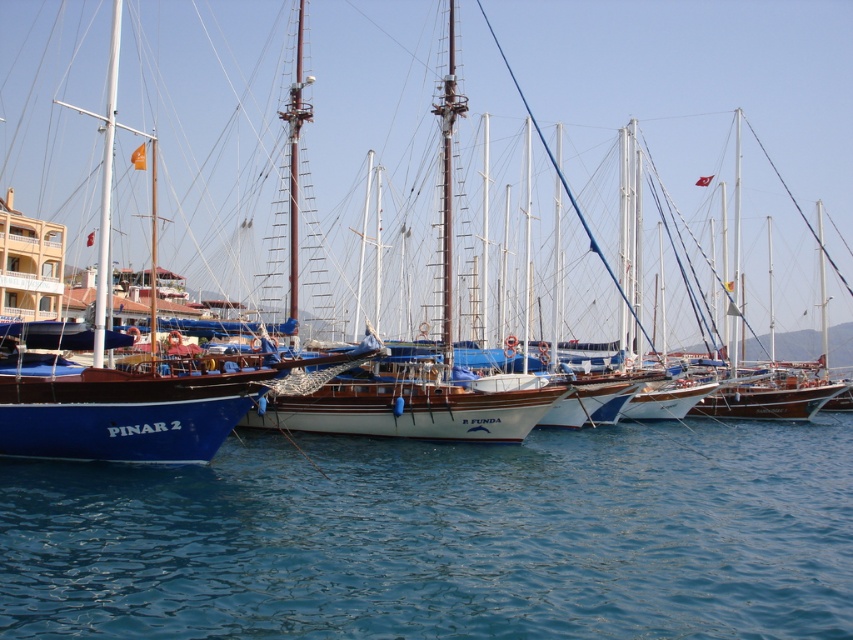
Does blue polished wood sailboat at left appear over blue water at lower left?

Correct, blue polished wood sailboat at left is located above blue water at lower left.

Is blue polished wood sailboat at left thinner than blue water at lower left?

Incorrect, blue polished wood sailboat at left's width is not less than blue water at lower left's.

Who is more distant from viewer, (521, 12) or (552, 634)?

The point (521, 12) is more distant.

Locate an element on the screen. blue polished wood sailboat at left is located at coordinates (689, 93).